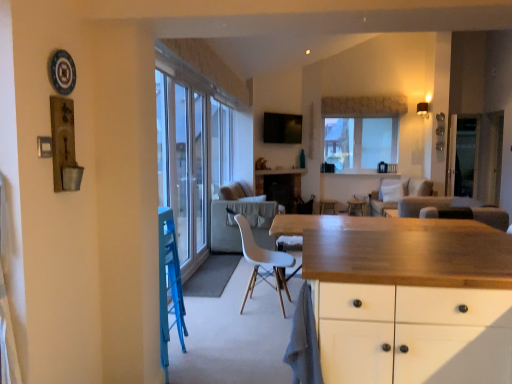
I want to click on beige fabric couch at center, the first couch positioned from the back, so click(x=398, y=192).

The width and height of the screenshot is (512, 384). What do you see at coordinates (327, 206) in the screenshot?
I see `wooden bar stool at center` at bounding box center [327, 206].

Measure the distance between point (320, 207) and camera.

6.41 meters.

Where is `transparent glass screen door at center`? The image size is (512, 384). transparent glass screen door at center is located at coordinates (181, 171).

Describe the element at coordinates (447, 212) in the screenshot. The height and width of the screenshot is (384, 512). I see `dark brown leather armchair at center` at that location.

What is the approximate width of textured beige curtain at upper center?

The width of textured beige curtain at upper center is 3.71 inches.

This screenshot has width=512, height=384. What are the coordinates of `textured beige curtain at upper center` in the screenshot? It's located at (362, 106).

Where is `beige fabric couch at center, the first couch positioned from the back`? This screenshot has width=512, height=384. beige fabric couch at center, the first couch positioned from the back is located at coordinates (398, 192).

Measure the distance from wooden bar stool at center to clear glass window at upper center.

wooden bar stool at center and clear glass window at upper center are 4.85 feet apart.

Is point (330, 203) closer to camera compared to point (398, 124)?

That is True.

Considering the relative positions of wooden bar stool at center and clear glass window at upper center in the image provided, is wooden bar stool at center behind clear glass window at upper center?

No, it is in front of clear glass window at upper center.

From a real-world perspective, is wooden bar stool at center over clear glass window at upper center?

Incorrect, from a real-world perspective, wooden bar stool at center is lower than clear glass window at upper center.

Is textured beige curtain at upper center next to beige fabric couch at center, the first couch positioned from the back?

No, textured beige curtain at upper center is not touching beige fabric couch at center, the first couch positioned from the back.

Considering the sizes of textured beige curtain at upper center and beige fabric couch at center, positioned as the second couch in front-to-back order, in the image, is textured beige curtain at upper center bigger or smaller than beige fabric couch at center, positioned as the second couch in front-to-back order,?

Considering their sizes, textured beige curtain at upper center takes up less space than beige fabric couch at center, positioned as the second couch in front-to-back order.

Based on the photo, is the depth of textured beige curtain at upper center less than that of beige fabric couch at center, positioned as the second couch in front-to-back order?

No, textured beige curtain at upper center is behind beige fabric couch at center, positioned as the second couch in front-to-back order.

Considering the points (325, 203) and (447, 207), which point is behind, point (325, 203) or point (447, 207)?

Positioned behind is point (325, 203).

Is wooden bar stool at center in front of or behind dark brown leather armchair at center in the image?

In the image, wooden bar stool at center appears behind dark brown leather armchair at center.

Is there a large distance between wooden bar stool at center and dark brown leather armchair at center?

Absolutely, wooden bar stool at center is distant from dark brown leather armchair at center.

Does wooden bar stool at center have a greater height compared to dark brown leather armchair at center?

Yes, wooden bar stool at center is taller than dark brown leather armchair at center.

Would you consider transparent glass door at right to be distant from clear glass window at upper center?

Yes, transparent glass door at right is far from clear glass window at upper center.

Can you confirm if transparent glass door at right is wider than clear glass window at upper center?

Indeed, transparent glass door at right has a greater width compared to clear glass window at upper center.

From a real-world perspective, relative to clear glass window at upper center, is transparent glass door at right vertically above or below?

From a real-world perspective, transparent glass door at right is physically below clear glass window at upper center.

From the image's perspective, is light gray fabric couch at center, which is the first couch from front to back, above or below transparent glass door at right?

From the image's perspective, light gray fabric couch at center, which is the first couch from front to back, appears below transparent glass door at right.

How different are the orientations of light gray fabric couch at center, acting as the 2th couch starting from the back, and transparent glass door at right in degrees?

light gray fabric couch at center, acting as the 2th couch starting from the back, and transparent glass door at right are facing 178 degrees away from each other.

Which object is positioned more to the right, light gray fabric couch at center, acting as the 2th couch starting from the back, or transparent glass door at right?

From the viewer's perspective, transparent glass door at right appears more on the right side.

Based on the photo, in the image, is wooden table at center positioned in front of or behind beige fabric couch at center, the first couch positioned from the back?

Visually, wooden table at center is located behind beige fabric couch at center, the first couch positioned from the back.

Could beige fabric couch at center, the first couch positioned from the back, be considered to be inside wooden table at center?

No, beige fabric couch at center, the first couch positioned from the back, is located outside of wooden table at center.

From a real-world perspective, is wooden table at center beneath beige fabric couch at center, positioned as the second couch in front-to-back order?

Indeed, from a real-world perspective, wooden table at center is positioned beneath beige fabric couch at center, positioned as the second couch in front-to-back order.

Is white plastic chair at center shorter than light gray fabric couch at center, which is the first couch from front to back?

No.

Does point (292, 265) lie in front of point (412, 197)?

That is True.

Considering the relative sizes of white plastic chair at center and light gray fabric couch at center, acting as the 2th couch starting from the back, in the image provided, is white plastic chair at center bigger than light gray fabric couch at center, acting as the 2th couch starting from the back,?

Incorrect, white plastic chair at center is not larger than light gray fabric couch at center, acting as the 2th couch starting from the back.

Find the location of a particular element. The width and height of the screenshot is (512, 384). bar stool lying on the left of clear glass window at upper center is located at coordinates (327, 206).

This screenshot has height=384, width=512. In order to click on curtain behind the beige fabric couch at center, the first couch positioned from the back in this screenshot , I will do `click(362, 106)`.

When comparing their distances from white plastic chair at center, does wooden countertop at center or clear glass window at upper center seem closer?

wooden countertop at center is positioned closer to the anchor white plastic chair at center.

Looking at the image, which one is located closer to wooden bar stool at center, wooden table at center or dark brown leather armchair at center?

wooden table at center.

From the image, which object appears to be farther from transparent glass door at right, clear glass window at upper center or light gray fabric couch at center, acting as the 2th couch starting from the back?

clear glass window at upper center is further to transparent glass door at right.

Estimate the real-world distances between objects in this image. Which object is closer to beige fabric couch at center, positioned as the second couch in front-to-back order, white plastic chair at center or dark brown leather armchair at center?

dark brown leather armchair at center is closer to beige fabric couch at center, positioned as the second couch in front-to-back order.

When comparing their distances from white plastic chair at center, does wooden table at center or beige fabric couch at center, the first couch positioned from the back, seem closer?

The object closer to white plastic chair at center is wooden table at center.

Consider the image. From the image, which object appears to be farther from dark brown leather armchair at center, beige fabric couch at center, the first couch positioned from the back, or light gray fabric couch at center, acting as the 2th couch starting from the back?

Among the two, beige fabric couch at center, the first couch positioned from the back, is located further to dark brown leather armchair at center.

Based on the photo, from the image, which object appears to be nearer to textured beige curtain at upper center, wooden bar stool at center or beige fabric couch at center, positioned as the second couch in front-to-back order?

beige fabric couch at center, positioned as the second couch in front-to-back order.

Looking at the image, which one is located further to dark brown leather armchair at center, beige fabric couch at center, the first couch positioned from the back, or wooden countertop at center?

wooden countertop at center is further to dark brown leather armchair at center.

Where is `window situated between wooden countertop at center and beige fabric couch at center, positioned as the second couch in front-to-back order, from left to right`? This screenshot has height=384, width=512. window situated between wooden countertop at center and beige fabric couch at center, positioned as the second couch in front-to-back order, from left to right is located at coordinates (362, 131).

I want to click on counter top between dark brown leather armchair at center and wooden table at center from front to back, so click(x=281, y=171).

Find the location of a particular element. screen door positioned between white plastic chair at center and wooden table at center from near to far is located at coordinates (181, 171).

Where is `couch between dark brown leather armchair at center and wooden countertop at center along the z-axis`? The width and height of the screenshot is (512, 384). couch between dark brown leather armchair at center and wooden countertop at center along the z-axis is located at coordinates (398, 192).